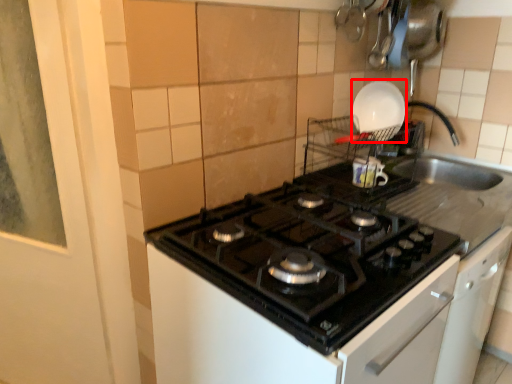
Question: Where is kitchen appliance (annotated by the red box) located in relation to gas stove in the image?

Choices:
 (A) right
 (B) left

Answer: (A)